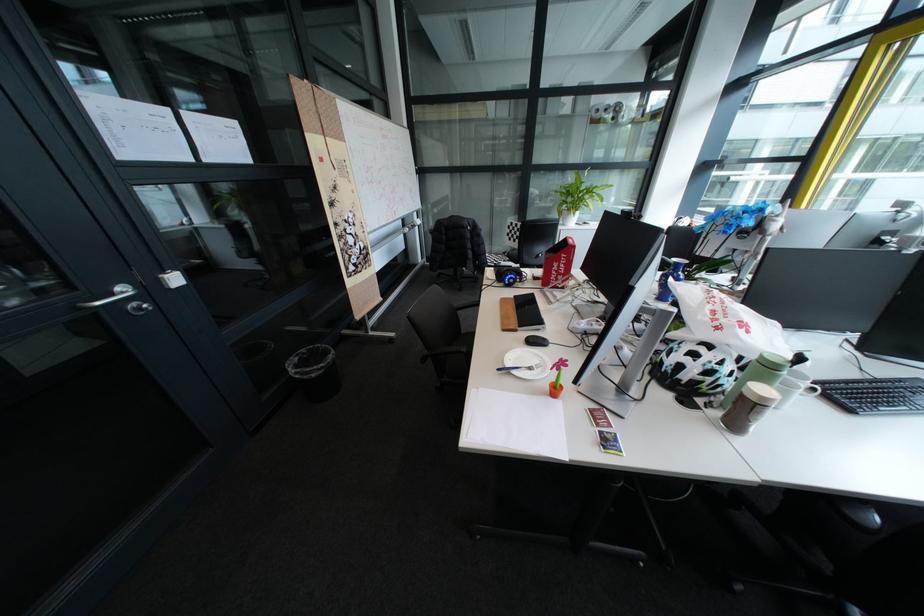
The image size is (924, 616). Identify the location of black computer mouse. (536, 339).